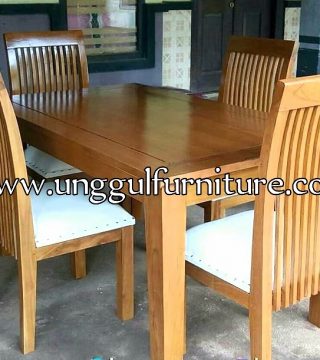
Where is `chair backs`? The height and width of the screenshot is (360, 320). chair backs is located at coordinates (311, 93), (279, 45), (58, 37), (9, 109).